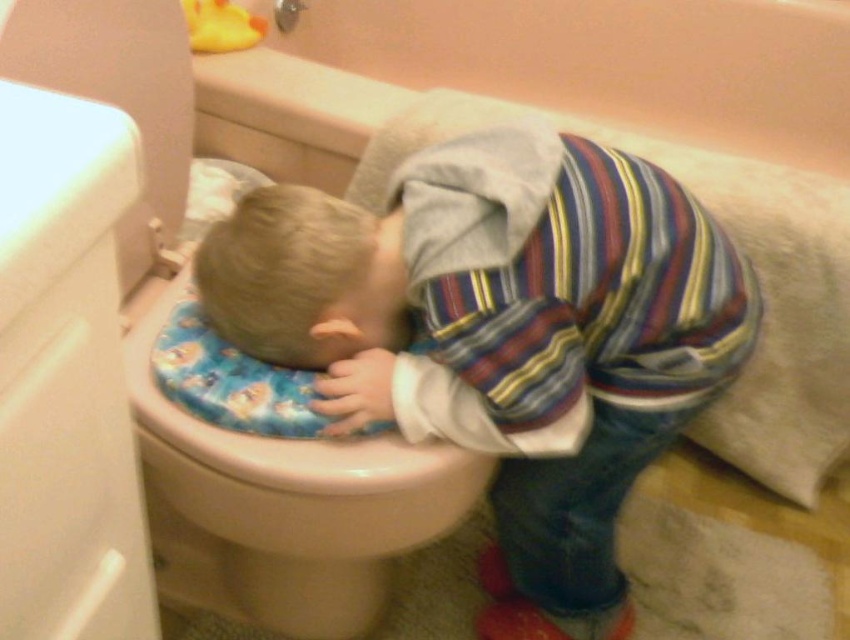
You are a parent trying to determine if your child can reach the white glossy toilet at left while wearing the striped fabric shirt at center. Based on their size, can the child reach the toilet?

The striped fabric shirt at center is smaller than the white glossy toilet at left, which suggests the child wearing it is smaller in size. Therefore, the child may not be tall enough to comfortably reach the toilet.

You are a parent trying to locate your child in the bathroom. You see the striped fabric shirt at center and the white glossy toilet at left. Which object is closer to you?

The striped fabric shirt at center is closer to you because it is further to the viewer than the white glossy toilet at left.

The child in the bathroom is wearing a striped fabric shirt at center and has blonde hair at center. Which of these items is wider?

The striped fabric shirt at center is wider than the blonde hair at center.